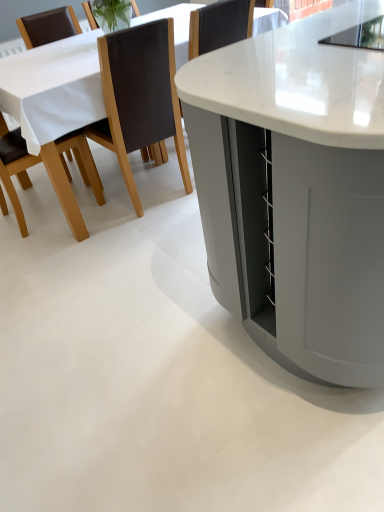
I want to click on space that is in front of brown leather chair at left, the 2th chair in the right-to-left sequence, so click(x=41, y=252).